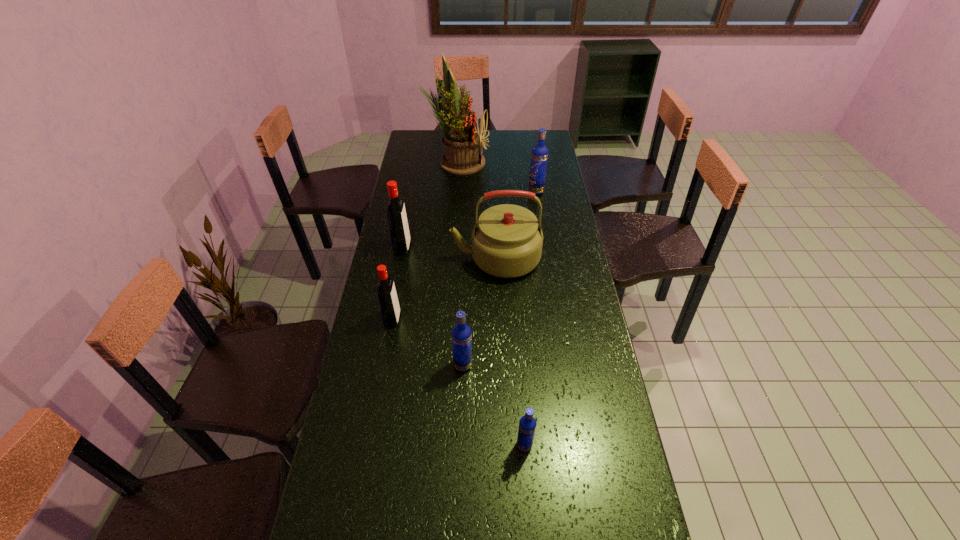
What are the coordinates of `vacant space at the far left corner` in the screenshot? It's located at [439, 130].

This screenshot has height=540, width=960. In the image, there is a desktop. What are the coordinates of `free space at the far right corner` in the screenshot? It's located at (553, 145).

This screenshot has width=960, height=540. I want to click on vacant space in between the nearest vodka and the third farthest vodka, so click(x=459, y=382).

Identify the location of vacant area that lies between the farthest object and the farther red vodka. (429, 205).

I want to click on blank region between the leftmost blue vodka and the nearer red vodka, so click(x=427, y=342).

The height and width of the screenshot is (540, 960). Find the location of `free spot between the leftmost blue vodka and the farthest object`. free spot between the leftmost blue vodka and the farthest object is located at coordinates (460, 264).

This screenshot has width=960, height=540. I want to click on free spot between the farthest object and the third nearest object, so click(424, 240).

Find the location of a particular element. Image resolution: width=960 pixels, height=540 pixels. free spot between the fourth nearest vodka and the third farthest vodka is located at coordinates (397, 284).

Locate which object ranks in proximity to the second farthest vodka. Please provide its 2D coordinates. Your answer should be formatted as a tuple, i.e. [(x, y)], where the tuple contains the x and y coordinates of a point satisfying the conditions above.

[(507, 240)]

Choose which object is the fifth nearest neighbor to the second blue vodka from right to left. Please provide its 2D coordinates. Your answer should be formatted as a tuple, i.e. [(x, y)], where the tuple contains the x and y coordinates of a point satisfying the conditions above.

[(539, 156)]